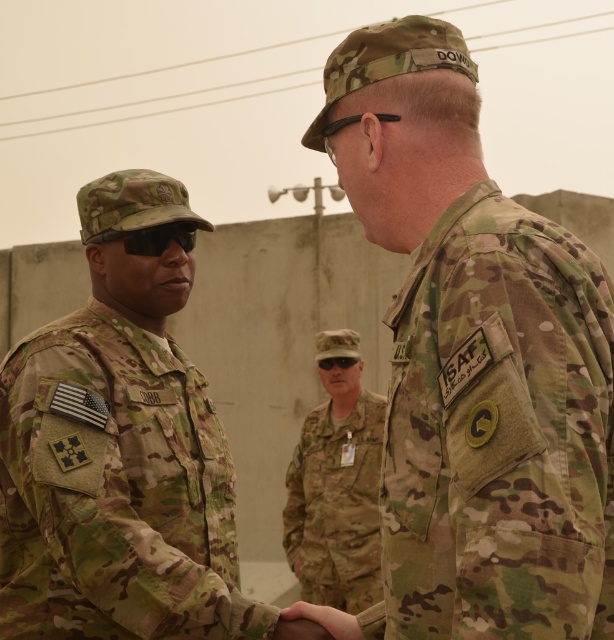
Question: Can you confirm if camouflage uniform at center is smaller than camo fabric uniform at center?

Choices:
 (A) yes
 (B) no

Answer: (A)

Question: Can you confirm if camo fabric uniform at center is bigger than black matte sunglasses at center?

Choices:
 (A) no
 (B) yes

Answer: (B)

Question: Which object is farther from the camera taking this photo?

Choices:
 (A) camouflage uniform at center
 (B) camouflage fabric uniform at left
 (C) matte black goggles at center
 (D) camo fabric uniform at center

Answer: (C)

Question: Which of the following is the farthest from the observer?

Choices:
 (A) (483, 504)
 (B) (138, 234)
 (C) (381, 445)
 (D) (74, 432)

Answer: (C)

Question: Which object appears farthest from the camera in this image?

Choices:
 (A) camouflage fabric uniform at left
 (B) camouflage uniform at center
 (C) black matte sunglasses at center
 (D) camo fabric uniform at center

Answer: (D)

Question: Can you confirm if camouflage uniform at center is wider than camouflage fabric uniform at left?

Choices:
 (A) no
 (B) yes

Answer: (A)